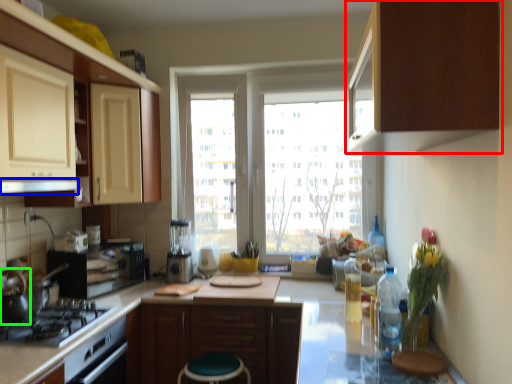
Question: Estimate the real-world distances between objects in this image. Which object is farther from cabinetry (highlighted by a red box), exhaust hood (highlighted by a blue box) or tea pot (highlighted by a green box)?

Choices:
 (A) exhaust hood
 (B) tea pot

Answer: (B)